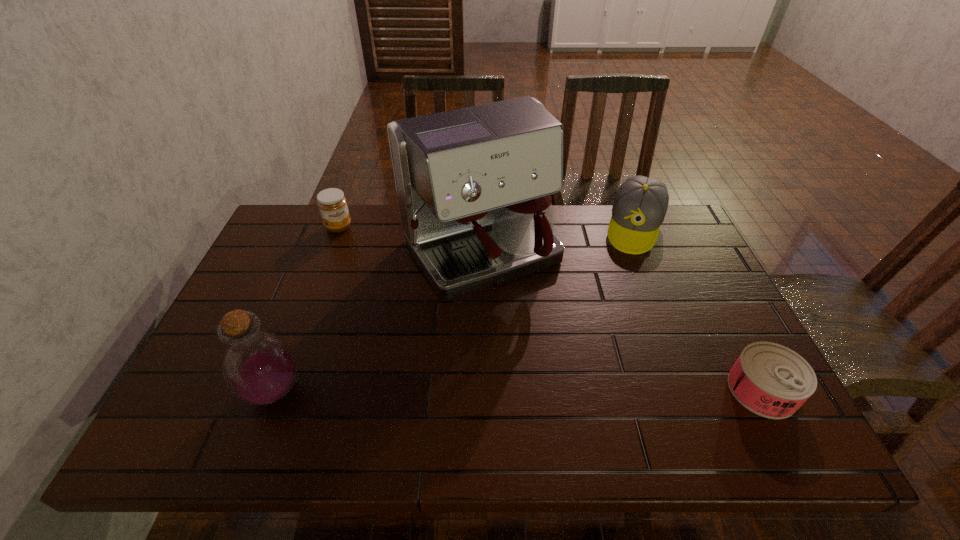
You are a GUI agent. You are given a task and a screenshot of the screen. Output one action in this format:
    pyautogui.click(x=<x>, y=<y>)
    Task: Click on the free spot at the far edge of the desktop
    
    Given the screenshot: What is the action you would take?
    coord(600,224)

Identify the location of vacant space at the near edge. (539, 394).

The image size is (960, 540). In the image, there is a desktop. Find the location of `vacant space at the left edge`. vacant space at the left edge is located at coordinates (248, 281).

I want to click on vacant space at the right edge, so click(x=681, y=256).

Identify the location of blank space at the far right corner. (663, 245).

Where is `unoccupied position between the third shortest object and the can`? unoccupied position between the third shortest object and the can is located at coordinates (698, 309).

The width and height of the screenshot is (960, 540). In order to click on free area in between the baseball cap and the can in this screenshot , I will do `click(698, 309)`.

I want to click on vacant region between the jam and the bottle, so click(x=306, y=309).

Locate an element on the screen. This screenshot has width=960, height=540. free space between the third object from right to left and the can is located at coordinates (621, 322).

You are a GUI agent. You are given a task and a screenshot of the screen. Output one action in this format:
    pyautogui.click(x=<x>, y=<y>)
    Task: Click on the blank region between the jam and the bottle
    
    Given the screenshot: What is the action you would take?
    pyautogui.click(x=306, y=309)